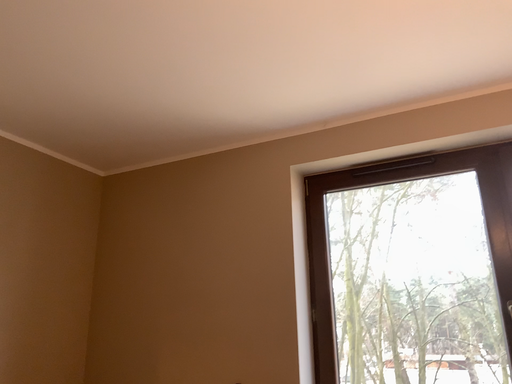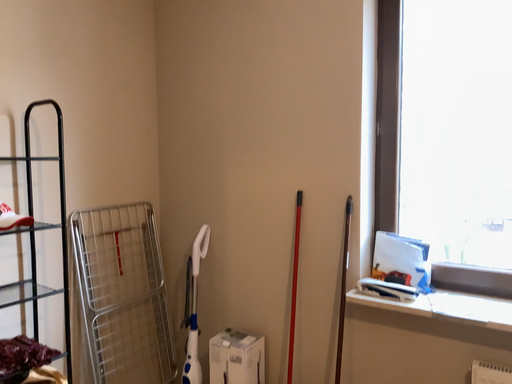
Question: Which way did the camera rotate in the video?

Choices:
 (A) rotated downward
 (B) rotated upward

Answer: (A)